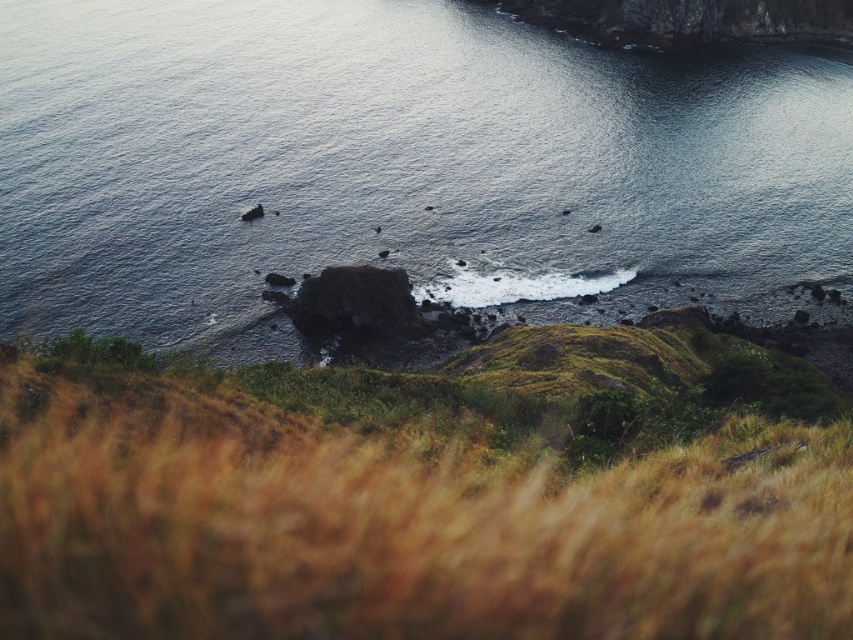
Question: Which point is farther to the camera?

Choices:
 (A) brown grassy hillside at lower center
 (B) dark blue water at center

Answer: (B)

Question: Does dark blue water at center appear on the left side of brown grassy hillside at lower center?

Choices:
 (A) yes
 (B) no

Answer: (B)

Question: Is dark blue water at center in front of brown grassy hillside at lower center?

Choices:
 (A) no
 (B) yes

Answer: (A)

Question: Which of the following is the farthest from the observer?

Choices:
 (A) (62, 588)
 (B) (776, 100)

Answer: (B)

Question: Can you confirm if dark blue water at center is positioned to the right of brown grassy hillside at lower center?

Choices:
 (A) no
 (B) yes

Answer: (B)